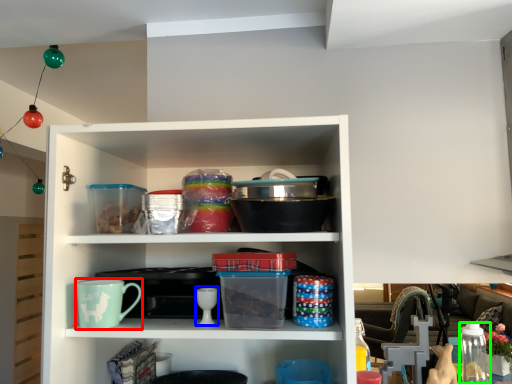
Question: Based on their relative distances, which object is nearer to mug (highlighted by a red box)? Choose from tableware (highlighted by a blue box) and glass jar (highlighted by a green box).

Choices:
 (A) tableware
 (B) glass jar

Answer: (A)